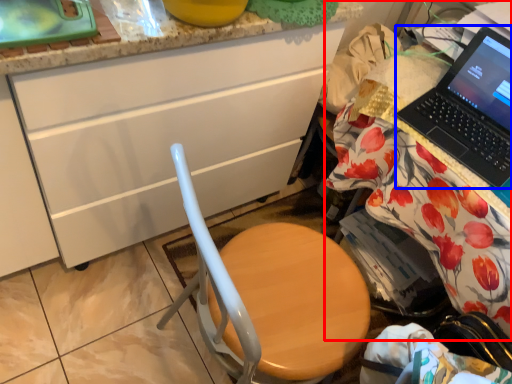
Question: Which object is further to the camera taking this photo, desk (highlighted by a red box) or laptop (highlighted by a blue box)?

Choices:
 (A) desk
 (B) laptop

Answer: (B)